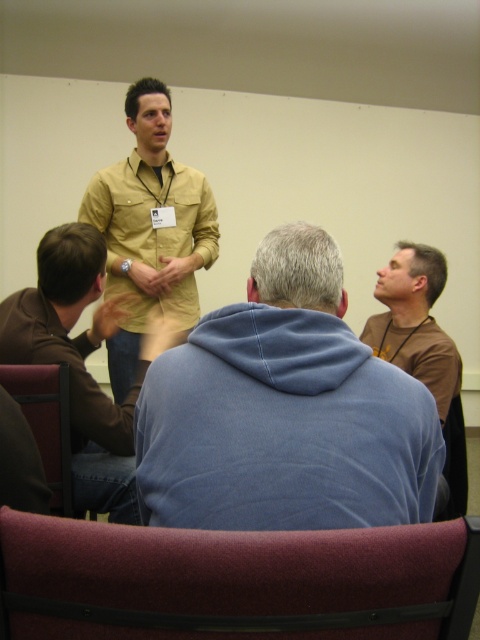
You are a guest entering the meeting room and see the brown leather jacket at upper left and the maroon fabric chair at lower right. Which object is closer to the entrance of the room?

The brown leather jacket at upper left is positioned over the maroon fabric chair at lower right, so the brown leather jacket at upper left is closer to the entrance of the room.

You are organizing a small workshop and need to seat two people comfortably. The maroon fabric chair at lower center and the maroon fabric chair at lower right are available. Which chair should you choose if you want more space for the attendee?

The maroon fabric chair at lower center has a greater width than the maroon fabric chair at lower right, so it provides more space for the attendee.

You are organizing a photo shoot and need to ensure that the two subjects wearing the brown leather jacket at upper left and the brown matte shirt at upper right are positioned at least 36 inches apart for proper lighting. Based on the current setup, will their current distance meet this requirement?

The brown leather jacket at upper left and brown matte shirt at upper right are 30.80 inches apart, which is less than the required 36 inches. Therefore, their current distance does not meet the requirement.